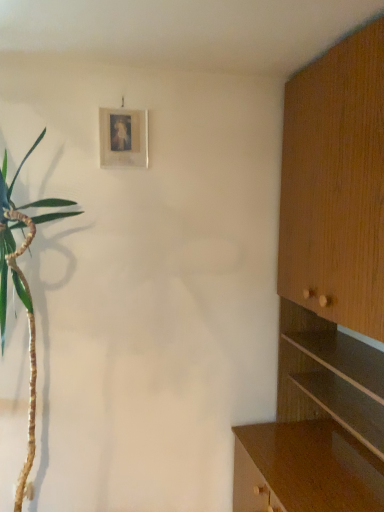
In order to face wooden cabinet at right, should I rotate leftwards or rightwards?

To face it directly, rotate right by 18.592 degrees.

Describe the element at coordinates (327, 295) in the screenshot. I see `wooden cabinet at right` at that location.

Identify the location of wooden cabinet at right. The height and width of the screenshot is (512, 384). (327, 295).

Identify the location of matte wooden picture frame at upper center. This screenshot has height=512, width=384. (123, 138).

What do you see at coordinates (123, 138) in the screenshot? I see `matte wooden picture frame at upper center` at bounding box center [123, 138].

Locate an element on the screen. This screenshot has height=512, width=384. wooden cabinet at right is located at coordinates (327, 295).

Considering the relative positions of matte wooden picture frame at upper center and wooden cabinet at right in the image provided, is matte wooden picture frame at upper center to the right of wooden cabinet at right from the viewer's perspective?

No, matte wooden picture frame at upper center is not to the right of wooden cabinet at right.

Which object is closer to the camera taking this photo, matte wooden picture frame at upper center or wooden cabinet at right?

wooden cabinet at right is in front.

Which is less distant, (127, 114) or (347, 406)?

The point (347, 406) is closer.

Consider the image. From the image's perspective, between matte wooden picture frame at upper center and wooden cabinet at right, who is located below?

From the image's view, wooden cabinet at right is below.

From the picture: From a real-world perspective, is matte wooden picture frame at upper center physically below wooden cabinet at right?

No, from a real-world perspective, matte wooden picture frame at upper center is not under wooden cabinet at right.

Which object is wider, matte wooden picture frame at upper center or wooden cabinet at right?

wooden cabinet at right.

Who is taller, matte wooden picture frame at upper center or wooden cabinet at right?

With more height is wooden cabinet at right.

Which of these two, matte wooden picture frame at upper center or wooden cabinet at right, is smaller?

matte wooden picture frame at upper center is smaller.

Is matte wooden picture frame at upper center inside the boundaries of wooden cabinet at right, or outside?

matte wooden picture frame at upper center lies outside wooden cabinet at right.

Is matte wooden picture frame at upper center far away from wooden cabinet at right?

Yes, matte wooden picture frame at upper center is far from wooden cabinet at right.

Is matte wooden picture frame at upper center oriented away from wooden cabinet at right?

No, matte wooden picture frame at upper center is not facing the opposite direction of wooden cabinet at right.

What are the coordinates of `cabinetry that appears below the matte wooden picture frame at upper center (from a real-world perspective)` in the screenshot? It's located at (327, 295).

Visually, is wooden cabinet at right positioned to the left or to the right of matte wooden picture frame at upper center?

From the image, it's evident that wooden cabinet at right is to the right of matte wooden picture frame at upper center.

From the picture: Considering the positions of objects wooden cabinet at right and matte wooden picture frame at upper center in the image provided, who is in front, wooden cabinet at right or matte wooden picture frame at upper center?

wooden cabinet at right is in front.

Is point (383, 415) closer or farther from the camera than point (139, 145)?

Point (383, 415) appears to be closer to the viewer than point (139, 145).

From the image's perspective, which is above, wooden cabinet at right or matte wooden picture frame at upper center?

matte wooden picture frame at upper center appears higher in the image.

From a real-world perspective, who is located lower, wooden cabinet at right or matte wooden picture frame at upper center?

wooden cabinet at right is physically lower.

In terms of width, does wooden cabinet at right look wider or thinner when compared to matte wooden picture frame at upper center?

In the image, wooden cabinet at right appears to be wider than matte wooden picture frame at upper center.

Who is taller, wooden cabinet at right or matte wooden picture frame at upper center?

wooden cabinet at right is taller.

Based on the photo, does wooden cabinet at right have a larger size compared to matte wooden picture frame at upper center?

Yes.

Looking at this image, do you think wooden cabinet at right is within matte wooden picture frame at upper center, or outside of it?

wooden cabinet at right is spatially situated outside matte wooden picture frame at upper center.

Is wooden cabinet at right beside matte wooden picture frame at upper center?

No, wooden cabinet at right is not in contact with matte wooden picture frame at upper center.

Consider the image. Is wooden cabinet at right oriented towards matte wooden picture frame at upper center?

Yes, wooden cabinet at right is aimed at matte wooden picture frame at upper center.

How many degrees apart are the facing directions of wooden cabinet at right and matte wooden picture frame at upper center?

The facing directions of wooden cabinet at right and matte wooden picture frame at upper center are 89.7 degrees apart.

Measure the distance from wooden cabinet at right to matte wooden picture frame at upper center.

wooden cabinet at right is 3.36 feet from matte wooden picture frame at upper center.

Image resolution: width=384 pixels, height=512 pixels. I want to click on cabinetry on the right of matte wooden picture frame at upper center, so click(x=327, y=295).

In the image, there is a matte wooden picture frame at upper center. Identify the location of cabinetry below it (from the image's perspective). (327, 295).

In the image, there is a matte wooden picture frame at upper center. Where is `cabinetry below it (from a real-world perspective)`? cabinetry below it (from a real-world perspective) is located at coordinates (327, 295).